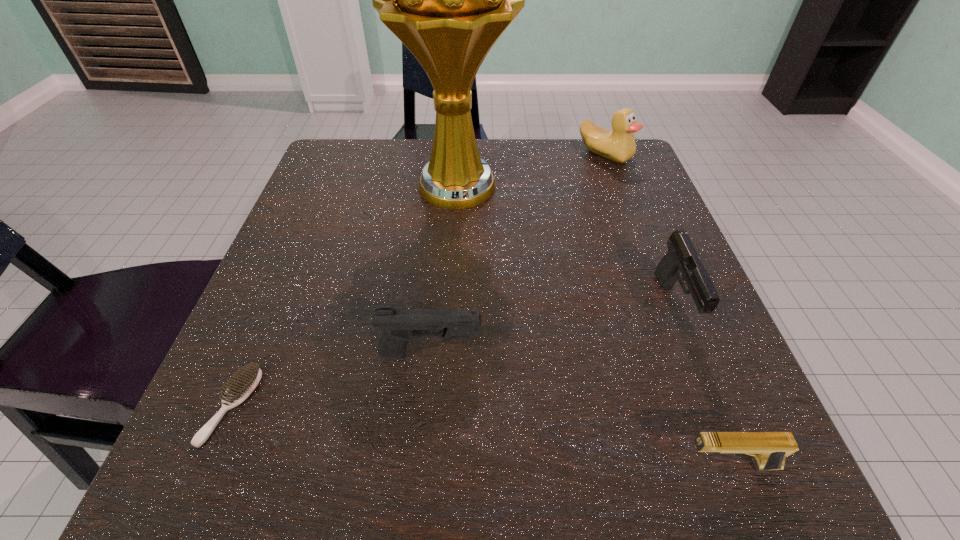
Locate an element on the screen. The height and width of the screenshot is (540, 960). vacant space at the far left corner is located at coordinates (330, 198).

Find the location of a particular element. The width and height of the screenshot is (960, 540). free spot at the far right corner of the desktop is located at coordinates (609, 170).

Where is `vacant space in between the farthest pistol and the leftmost object`? vacant space in between the farthest pistol and the leftmost object is located at coordinates (453, 356).

Identify the location of vacant area that lies between the tallest object and the duck. The width and height of the screenshot is (960, 540). (531, 171).

You are a GUI agent. You are given a task and a screenshot of the screen. Output one action in this format:
    pyautogui.click(x=<x>, y=<y>)
    Task: Click on the vacant region between the nearest object and the third farthest object
    This screenshot has width=960, height=540.
    Given the screenshot: What is the action you would take?
    pyautogui.click(x=702, y=386)

The image size is (960, 540). What are the coordinates of `vacant area that lies between the third farthest object and the nearest pistol` in the screenshot? It's located at (702, 386).

I want to click on free area in between the second farthest pistol and the farthest pistol, so click(553, 330).

Find the location of a particular element. free space between the fourth nearest object and the shortest pistol is located at coordinates (702, 386).

Identify the location of vacant area between the tallest object and the farthest pistol. (566, 247).

This screenshot has height=540, width=960. I want to click on free space between the shortest pistol and the trophy_cup, so (x=593, y=327).